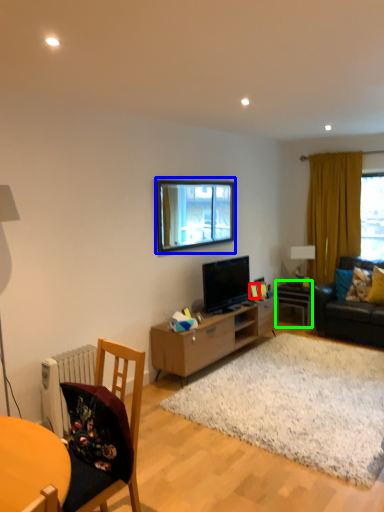
Question: Which is nearer to the picture frame (highlighted by a red box)? window (highlighted by a blue box) or table (highlighted by a green box).

Choices:
 (A) window
 (B) table

Answer: (B)